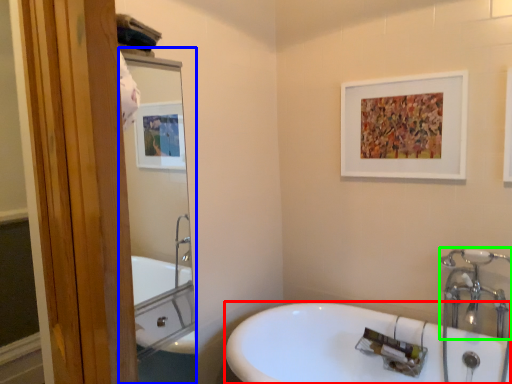
Question: Considering the real-world distances, which object is farthest from sink (highlighted by a red box)? mirror (highlighted by a blue box) or plumbing fixture (highlighted by a green box)?

Choices:
 (A) mirror
 (B) plumbing fixture

Answer: (A)